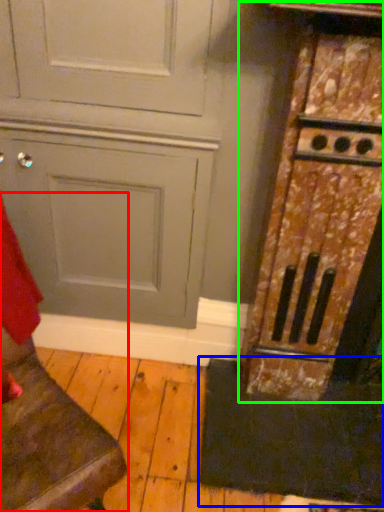
Question: Which is farther away from furniture (highlighted by a red box)? doormat (highlighted by a blue box) or cabinetry (highlighted by a green box)?

Choices:
 (A) doormat
 (B) cabinetry

Answer: (B)